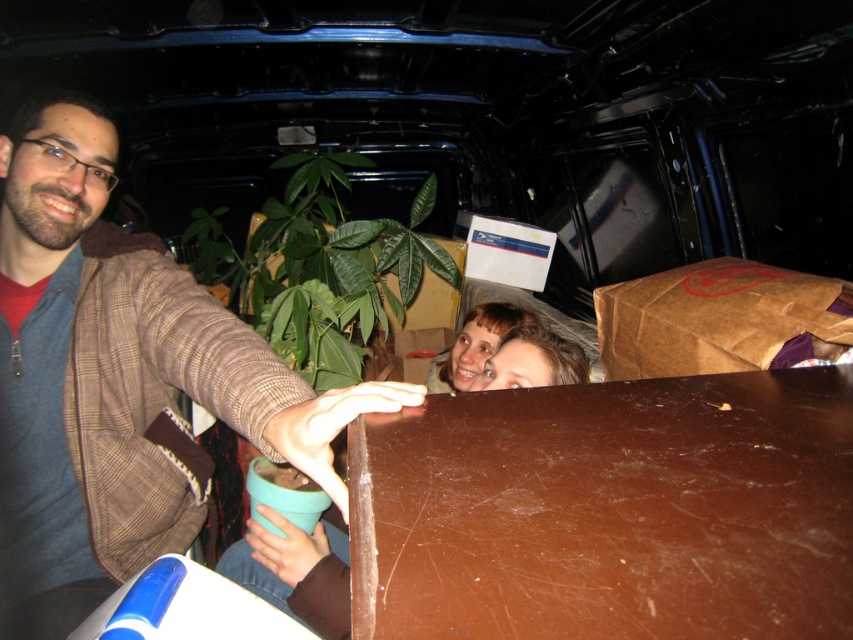
You are helping to load items into a van and need to know if the brown matte table at center can fit under the brown paper bag at upper right. Based on their heights, will the table clear the bag when moved underneath?

The brown matte table at center has a lesser height compared to brown paper bag at upper right, so when moved underneath, the table will not clear the bag and may hit it due to its shorter height.

You are a delivery person who needs to deliver a package to the person with matte brown hair at center. The package is 18 inches long. Can you place the package on the brown paper bag at upper right without it hanging off the edge?

The distance between the brown paper bag at upper right and matte brown hair at center is 16.93 inches. Since the package is 18 inches long, it would extend beyond the available space, so it won